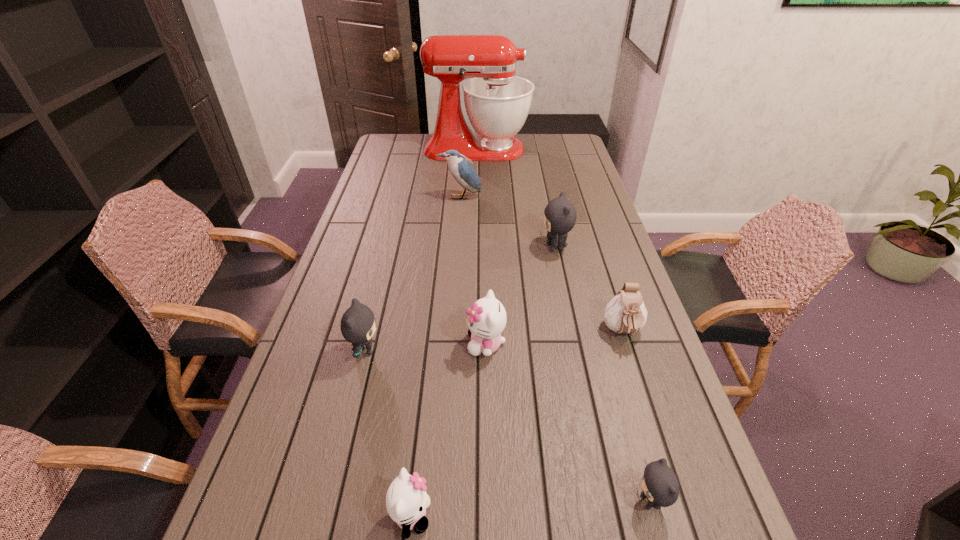
What are the coordinates of `free spot located 0.280m on the front-facing side of the second smallest gray kitten` in the screenshot? It's located at (489, 350).

Where is `free space located on the front-facing side of the white pouch`? free space located on the front-facing side of the white pouch is located at coordinates (670, 480).

The image size is (960, 540). I want to click on vacant space located 0.230m on the front-facing side of the smallest gray kitten, so click(x=516, y=501).

Find the location of a particular element. This screenshot has height=540, width=960. free space located on the front-facing side of the smallest gray kitten is located at coordinates (563, 501).

I want to click on free space located on the front-facing side of the smallest gray kitten, so click(x=454, y=501).

This screenshot has width=960, height=540. Identify the location of object present at the far edge. (497, 102).

The width and height of the screenshot is (960, 540). What are the coordinates of `object present at the left edge` in the screenshot? It's located at (357, 325).

At what (x,y) coordinates should I click in order to perform the action: click on pouch that is at the right edge. Please return your answer as a coordinate pair (x, y). Image resolution: width=960 pixels, height=540 pixels. Looking at the image, I should click on (626, 313).

You are a GUI agent. You are given a task and a screenshot of the screen. Output one action in this format:
    pyautogui.click(x=<x>, y=<y>)
    Task: Click on the vacant area at the far edge
    This screenshot has height=540, width=960.
    Given the screenshot: What is the action you would take?
    pyautogui.click(x=519, y=134)

Image resolution: width=960 pixels, height=540 pixels. What are the coordinates of `free location at the left edge` in the screenshot? It's located at (384, 273).